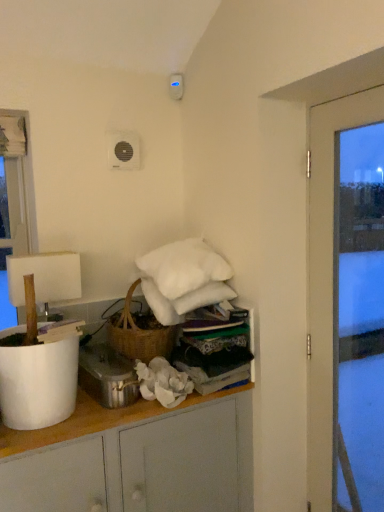
Question: From the image's perspective, is white fabric at upper center over white matte lampshade at left?

Choices:
 (A) yes
 (B) no

Answer: (B)

Question: Is the depth of white fabric at upper center less than that of white matte lampshade at left?

Choices:
 (A) no
 (B) yes

Answer: (B)

Question: Can you confirm if white fabric at upper center is positioned to the right of white matte lampshade at left?

Choices:
 (A) no
 (B) yes

Answer: (B)

Question: From a real-world perspective, is white fabric at upper center over white matte lampshade at left?

Choices:
 (A) yes
 (B) no

Answer: (B)

Question: Is white fabric at upper center positioned with its back to white matte lampshade at left?

Choices:
 (A) no
 (B) yes

Answer: (A)

Question: From the image's perspective, is metallic silver pot at lower center positioned above or below white matte cabinet at center?

Choices:
 (A) below
 (B) above

Answer: (B)

Question: Considering the relative positions of metallic silver pot at lower center and white matte cabinet at center in the image provided, is metallic silver pot at lower center to the left or to the right of white matte cabinet at center?

Choices:
 (A) left
 (B) right

Answer: (A)

Question: From a real-world perspective, is metallic silver pot at lower center above or below white matte cabinet at center?

Choices:
 (A) above
 (B) below

Answer: (A)

Question: From their relative heights in the image, would you say metallic silver pot at lower center is taller or shorter than white matte cabinet at center?

Choices:
 (A) tall
 (B) short

Answer: (B)

Question: Visually, is white fluffy pillow at upper center positioned to the left or to the right of white matte cabinet at center?

Choices:
 (A) left
 (B) right

Answer: (B)

Question: Is point (200, 264) positioned closer to the camera than point (190, 416)?

Choices:
 (A) closer
 (B) farther

Answer: (B)

Question: Is white fluffy pillow at upper center situated inside white matte cabinet at center or outside?

Choices:
 (A) inside
 (B) outside

Answer: (B)

Question: Relative to white matte cabinet at center, is white fluffy pillow at upper center in front or behind?

Choices:
 (A) front
 (B) behind

Answer: (B)

Question: Is transparent glass door at right taller or shorter than white matte cabinet at center?

Choices:
 (A) short
 (B) tall

Answer: (B)

Question: From the image's perspective, is transparent glass door at right above or below white matte cabinet at center?

Choices:
 (A) below
 (B) above

Answer: (B)